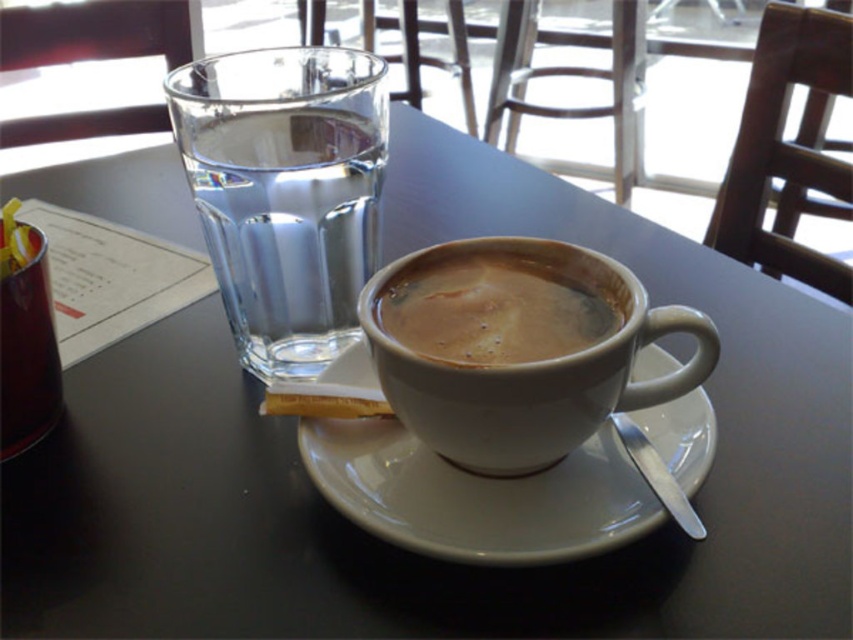
Question: Which object appears closest to the camera in this image?

Choices:
 (A) white matte mug at center
 (B) white ceramic saucer at center
 (C) clear glass water at upper left
 (D) brown matte cup at center

Answer: (A)

Question: Can you confirm if white matte mug at center is smaller than metallic red can at left?

Choices:
 (A) no
 (B) yes

Answer: (A)

Question: Considering the relative positions of white ceramic saucer at center and metallic red can at left in the image provided, where is white ceramic saucer at center located with respect to metallic red can at left?

Choices:
 (A) right
 (B) left

Answer: (A)

Question: Among these points, which one is farthest from the camera?

Choices:
 (A) (337, 460)
 (B) (35, 401)
 (C) (630, 401)

Answer: (B)

Question: Does clear glass water at upper left have a greater width compared to metallic red can at left?

Choices:
 (A) yes
 (B) no

Answer: (A)

Question: Which point is closer to the camera?

Choices:
 (A) white matte mug at center
 (B) clear glass water at upper left
 (C) brown matte cup at center
 (D) metallic red can at left

Answer: (A)